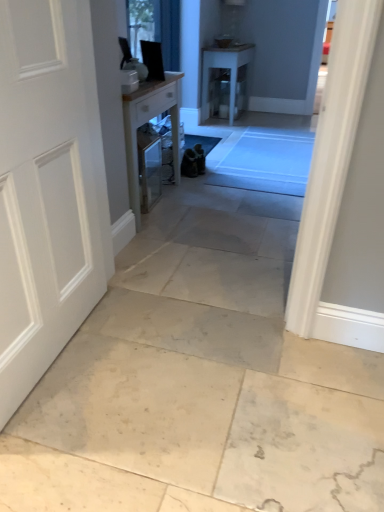
Question: Should I look upward or downward to see clear glass window at upper center?

Choices:
 (A) up
 (B) down

Answer: (A)

Question: Considering the relative sizes of white matte door at left and white glossy table at center, placed as the 1th table when sorted from top to bottom, in the image provided, is white matte door at left bigger than white glossy table at center, placed as the 1th table when sorted from top to bottom,?

Choices:
 (A) no
 (B) yes

Answer: (A)

Question: Considering the relative sizes of white matte door at left and white glossy table at center, which is counted as the 1th table, starting from the right, in the image provided, is white matte door at left taller than white glossy table at center, which is counted as the 1th table, starting from the right,?

Choices:
 (A) yes
 (B) no

Answer: (A)

Question: From the image's perspective, does white matte door at left appear higher than white glossy table at center, which is counted as the 1th table, starting from the right?

Choices:
 (A) no
 (B) yes

Answer: (A)

Question: Is white matte door at left not inside white glossy table at center, which is the 2th table from bottom to top?

Choices:
 (A) no
 (B) yes

Answer: (B)

Question: Could you tell me if white matte door at left is turned towards white glossy table at center, which is counted as the 1th table, starting from the right?

Choices:
 (A) yes
 (B) no

Answer: (B)

Question: From a real-world perspective, is white matte door at left physically above white glossy table at center, which is the 2th table from bottom to top?

Choices:
 (A) no
 (B) yes

Answer: (B)

Question: Is wooden table at center, which appears as the 1th table when viewed from the left, shorter than white glossy table at center, which is the 2th table from bottom to top?

Choices:
 (A) yes
 (B) no

Answer: (A)

Question: Considering the relative sizes of wooden table at center, which is the second table in top-to-bottom order, and white glossy table at center, positioned as the 2th table in front-to-back order, in the image provided, is wooden table at center, which is the second table in top-to-bottom order, wider than white glossy table at center, positioned as the 2th table in front-to-back order,?

Choices:
 (A) yes
 (B) no

Answer: (B)

Question: From the image's perspective, is wooden table at center, the first table positioned from the bottom, located beneath white glossy table at center, placed as the 1th table when sorted from top to bottom?

Choices:
 (A) yes
 (B) no

Answer: (A)

Question: Can you confirm if wooden table at center, positioned as the 2th table in back-to-front order, is bigger than white glossy table at center, placed as the 1th table when sorted from top to bottom?

Choices:
 (A) yes
 (B) no

Answer: (B)

Question: From a real-world perspective, is wooden table at center, the second table in the right-to-left sequence, on white glossy table at center, positioned as the 2th table in front-to-back order?

Choices:
 (A) no
 (B) yes

Answer: (B)

Question: Would you consider wooden table at center, the second table in the right-to-left sequence, to be distant from white glossy table at center, which is the 2th table from bottom to top?

Choices:
 (A) no
 (B) yes

Answer: (B)

Question: Is clear glass window at upper center surrounding white matte door at left?

Choices:
 (A) no
 (B) yes

Answer: (A)